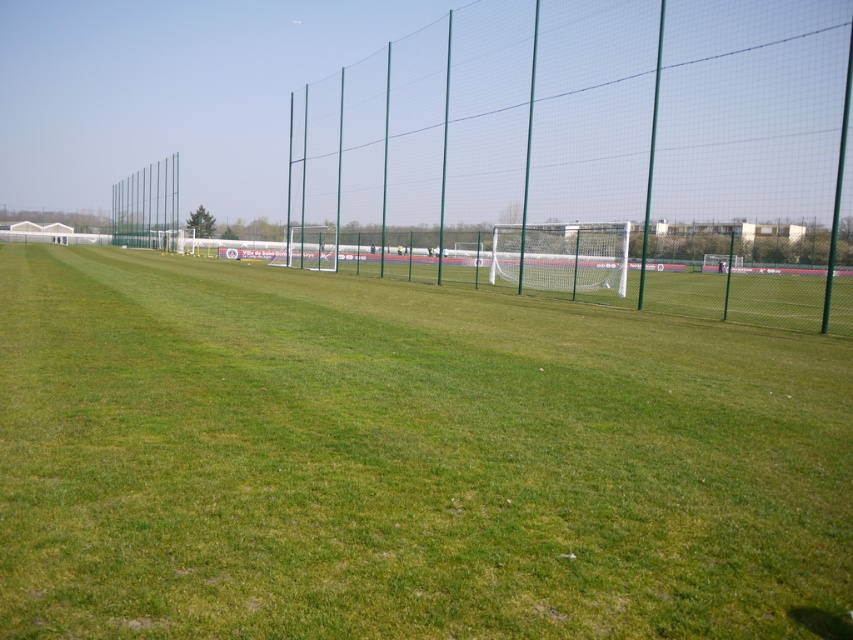
Question: Which of the following is the closest to the observer?

Choices:
 (A) green mesh fence at upper left
 (B) green grass at center
 (C) green mesh fence at center

Answer: (B)

Question: Which point is farther to the camera?

Choices:
 (A) green mesh fence at upper left
 (B) green mesh fence at center

Answer: (A)

Question: Does green mesh fence at center have a smaller size compared to green mesh fence at upper left?

Choices:
 (A) yes
 (B) no

Answer: (B)

Question: Is green mesh fence at center wider than green mesh fence at upper left?

Choices:
 (A) yes
 (B) no

Answer: (A)

Question: Is green grass at center thinner than green mesh fence at center?

Choices:
 (A) no
 (B) yes

Answer: (B)

Question: Estimate the real-world distances between objects in this image. Which object is farther from the green mesh fence at center?

Choices:
 (A) green grass at center
 (B) green mesh fence at upper left

Answer: (B)